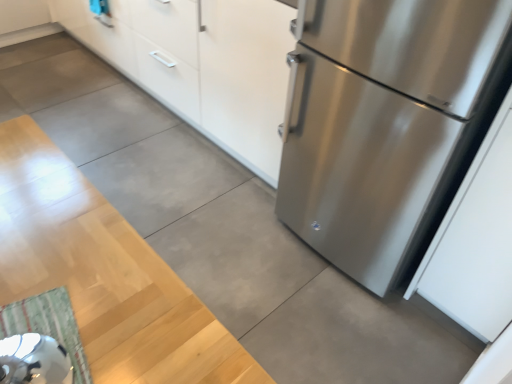
Question: Should I look upward or downward to see white matte cabinet at upper center?

Choices:
 (A) down
 (B) up

Answer: (B)

Question: Is stainless steel refrigerator at right at the back of green striped rug at lower left?

Choices:
 (A) no
 (B) yes

Answer: (A)

Question: From the image's perspective, does green striped rug at lower left appear higher than stainless steel refrigerator at right?

Choices:
 (A) yes
 (B) no

Answer: (B)

Question: Does green striped rug at lower left appear on the left side of stainless steel refrigerator at right?

Choices:
 (A) no
 (B) yes

Answer: (B)

Question: From the image's perspective, does green striped rug at lower left appear lower than stainless steel refrigerator at right?

Choices:
 (A) yes
 (B) no

Answer: (A)

Question: From a real-world perspective, does green striped rug at lower left stand above stainless steel refrigerator at right?

Choices:
 (A) no
 (B) yes

Answer: (A)

Question: Does green striped rug at lower left have a smaller size compared to stainless steel refrigerator at right?

Choices:
 (A) no
 (B) yes

Answer: (B)

Question: Is stainless steel refrigerator at right facing away from white matte cabinet at upper center?

Choices:
 (A) yes
 (B) no

Answer: (B)

Question: Does stainless steel refrigerator at right turn towards white matte cabinet at upper center?

Choices:
 (A) yes
 (B) no

Answer: (B)

Question: Considering the relative sizes of stainless steel refrigerator at right and white matte cabinet at upper center in the image provided, is stainless steel refrigerator at right taller than white matte cabinet at upper center?

Choices:
 (A) yes
 (B) no

Answer: (A)

Question: Is stainless steel refrigerator at right far from white matte cabinet at upper center?

Choices:
 (A) no
 (B) yes

Answer: (A)

Question: Is stainless steel refrigerator at right bigger than white matte cabinet at upper center?

Choices:
 (A) yes
 (B) no

Answer: (B)

Question: Does stainless steel refrigerator at right touch white matte cabinet at upper center?

Choices:
 (A) yes
 (B) no

Answer: (B)

Question: Does green striped rug at lower left have a greater width compared to white matte cabinet at upper center?

Choices:
 (A) yes
 (B) no

Answer: (B)